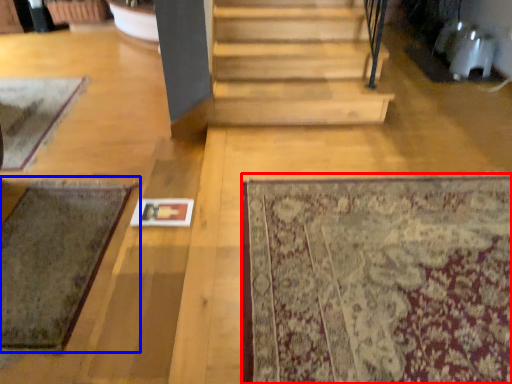
Question: Which point is further to the camera, mat (highlighted by a red box) or mat (highlighted by a blue box)?

Choices:
 (A) mat
 (B) mat

Answer: (B)